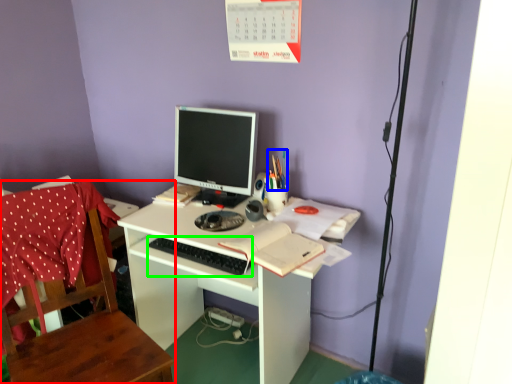
Question: Estimate the real-world distances between objects in this image. Which object is farther from chair (highlighted by a red box), stationery (highlighted by a blue box) or computer keyboard (highlighted by a green box)?

Choices:
 (A) stationery
 (B) computer keyboard

Answer: (A)